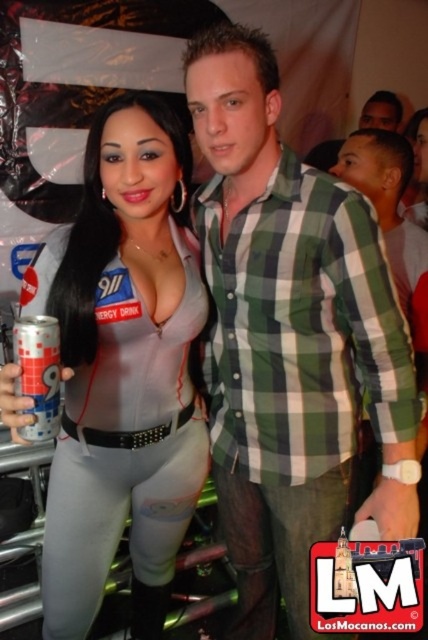
Question: Does satin silver jumpsuit at center appear on the right side of silver metallic can at left?

Choices:
 (A) yes
 (B) no

Answer: (B)

Question: Which point appears closest to the camera in this image?

Choices:
 (A) (389, 128)
 (B) (240, 596)

Answer: (B)

Question: Considering the relative positions of green plaid shirt at center and satin silver jumpsuit at center in the image provided, where is green plaid shirt at center located with respect to satin silver jumpsuit at center?

Choices:
 (A) left
 (B) right

Answer: (B)

Question: Is satin silver jumpsuit at center thinner than smooth skin face at upper right?

Choices:
 (A) no
 (B) yes

Answer: (B)

Question: Which object is closer to the camera taking this photo?

Choices:
 (A) green plaid shirt at center
 (B) smooth skin face at upper right

Answer: (A)

Question: Which object is farther from the camera taking this photo?

Choices:
 (A) smooth skin face at upper right
 (B) silver metallic can at left
 (C) green plaid shirt at center
 (D) satin silver jumpsuit at center

Answer: (A)